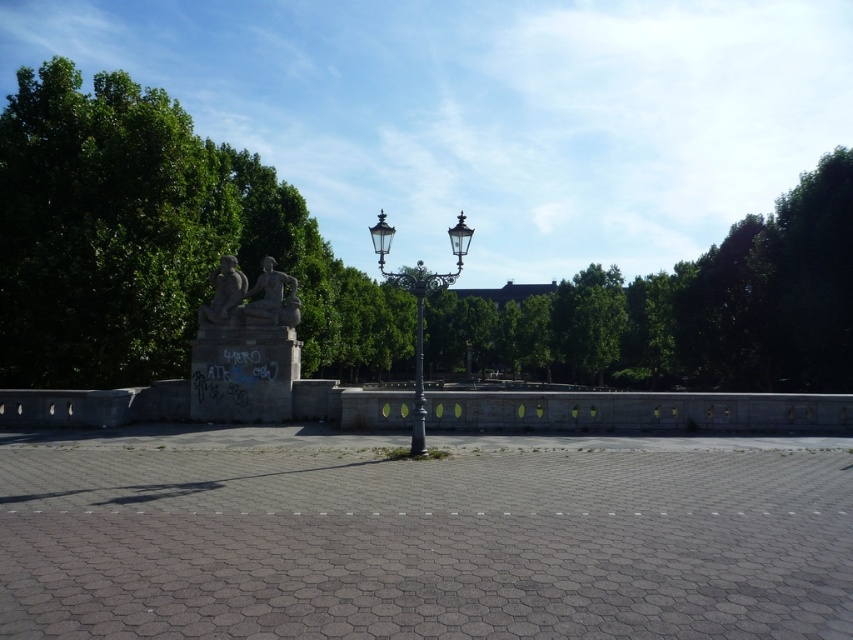
Is green leafy tree at center positioned behind polished bronze statue at center?

No, green leafy tree at center is in front of polished bronze statue at center.

Is green leafy tree at center taller than polished bronze statue at center?

Correct, green leafy tree at center is much taller as polished bronze statue at center.

Is point (813, 237) in front of point (248, 308)?

No.

Locate an element on the screen. This screenshot has height=640, width=853. green leafy tree at center is located at coordinates (154, 241).

Does polished bronze statue at center appear on the left side of stone statue at center?

In fact, polished bronze statue at center is to the right of stone statue at center.

Does polished bronze statue at center have a greater height compared to stone statue at center?

Yes.

Where is `polished bronze statue at center`? polished bronze statue at center is located at coordinates (271, 298).

At what (x,y) coordinates should I click in order to perform the action: click on polished bronze statue at center. Please return your answer as a coordinate pair (x, y). The width and height of the screenshot is (853, 640). Looking at the image, I should click on (271, 298).

Does polished brass lamp post at center have a lesser height compared to stone statue at center?

Incorrect, polished brass lamp post at center's height does not fall short of stone statue at center's.

Measure the distance between point (380, 260) and camera.

Point (380, 260) and camera are 44.10 feet apart from each other.

At what (x,y) coordinates should I click in order to perform the action: click on polished brass lamp post at center. Please return your answer as a coordinate pair (x, y). Looking at the image, I should click on (419, 304).

Find the location of `polished brass lamp post at center`. polished brass lamp post at center is located at coordinates (419, 304).